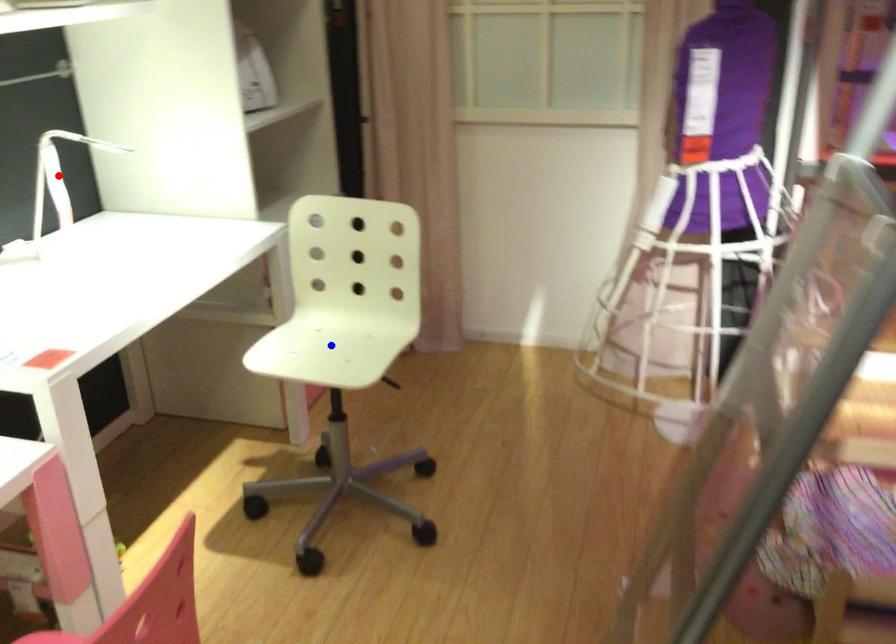
Question: In the image, two points are highlighted. Which point is nearer to the camera? Reply with the corresponding letter.

Choices:
 (A) blue point
 (B) red point

Answer: (A)